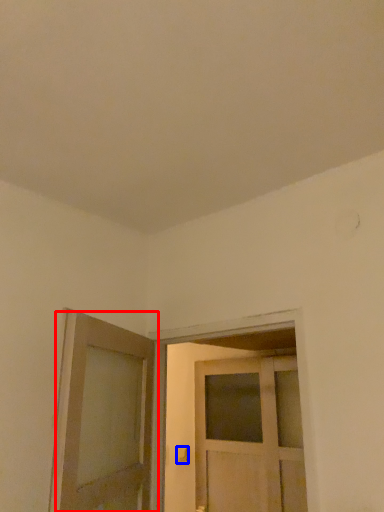
Question: Which point is closer to the camera, door (highlighted by a red box) or door handle (highlighted by a blue box)?

Choices:
 (A) door
 (B) door handle

Answer: (A)